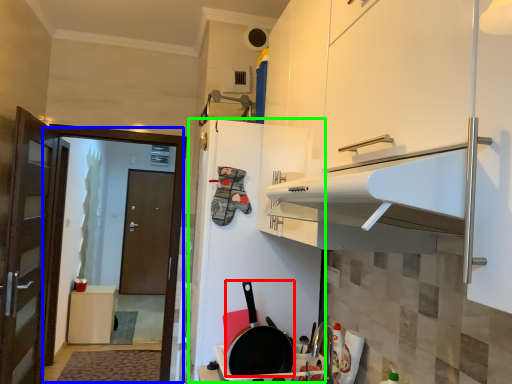
Question: Based on their relative distances, which object is nearer to frying pan (highlighted by a red box)? Choose from screen door (highlighted by a blue box) and fridge (highlighted by a green box).

Choices:
 (A) screen door
 (B) fridge

Answer: (B)